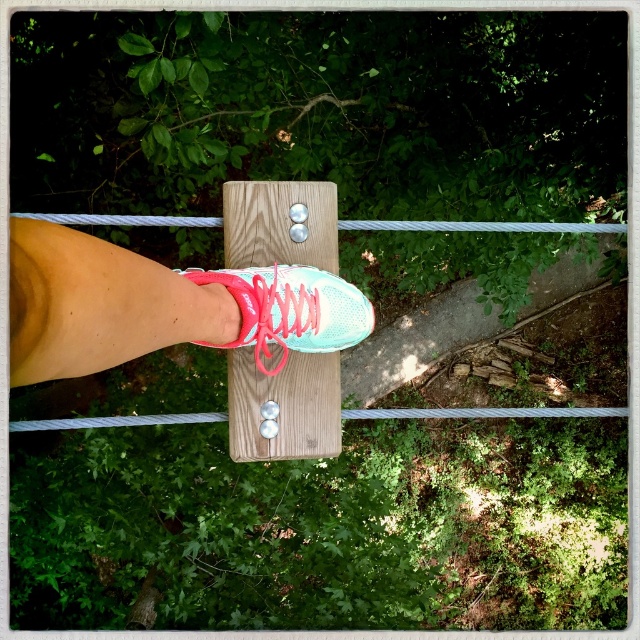
Who is lower down, shiny teal sneaker at center or teal matte shoe at center?

Positioned lower is teal matte shoe at center.

Does shiny teal sneaker at center have a larger size compared to teal matte shoe at center?

Yes, shiny teal sneaker at center is bigger than teal matte shoe at center.

At what (x,y) coordinates should I click in order to perform the action: click on shiny teal sneaker at center. Please return your answer as a coordinate pair (x, y). Looking at the image, I should click on (157, 307).